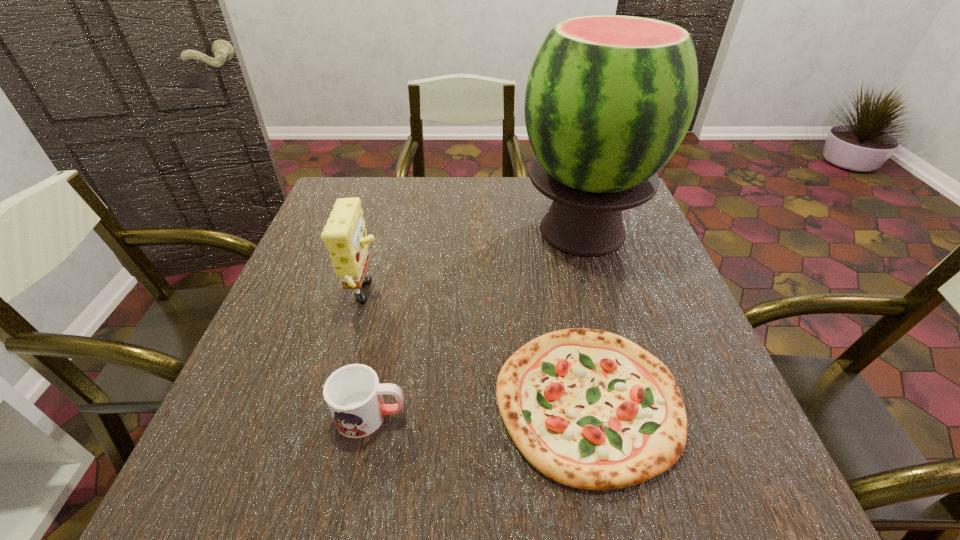
You are a GUI agent. You are given a task and a screenshot of the screen. Output one action in this format:
    pyautogui.click(x=<x>, y=<y>)
    Task: Click on the object that is positioned at the left edge
    The height and width of the screenshot is (540, 960).
    Given the screenshot: What is the action you would take?
    pyautogui.click(x=344, y=235)

Where is `watermelon that is positioned at the right edge`? The height and width of the screenshot is (540, 960). watermelon that is positioned at the right edge is located at coordinates (609, 98).

This screenshot has width=960, height=540. Identify the location of pizza present at the right edge. (590, 409).

Find the location of `object that is positioned at the far right corner`. object that is positioned at the far right corner is located at coordinates (609, 98).

I want to click on object that is at the near right corner, so click(x=590, y=409).

Where is `vacant space at the far edge of the desktop`? This screenshot has width=960, height=540. vacant space at the far edge of the desktop is located at coordinates (478, 215).

Where is `free space at the left edge`? free space at the left edge is located at coordinates (320, 309).

Locate an element on the screen. The height and width of the screenshot is (540, 960). vacant region at the right edge of the desktop is located at coordinates (614, 256).

This screenshot has height=540, width=960. In the image, there is a desktop. What are the coordinates of `vacant space at the far left corner` in the screenshot? It's located at (376, 180).

Where is `blank space at the near left corner of the desktop`? The height and width of the screenshot is (540, 960). blank space at the near left corner of the desktop is located at coordinates (292, 490).